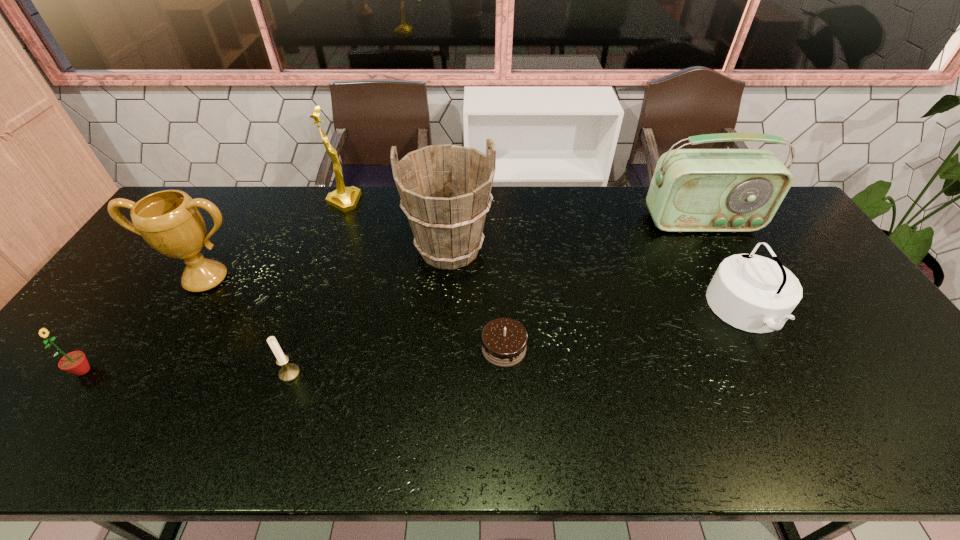
You are a GUI agent. You are given a task and a screenshot of the screen. Output one action in this format:
    pyautogui.click(x=<x>, y=<y>)
    Task: Click on the vacant space located 0.050m on the front of the bucket
    The image size is (960, 540).
    Given the screenshot: What is the action you would take?
    pyautogui.click(x=447, y=293)

Find the location of a particular element. vacant space situated 0.350m on the front-facing side of the farther award is located at coordinates (459, 202).

Locate an element on the screen. This screenshot has height=540, width=960. free space located on the front panel of the radio receiver is located at coordinates (746, 303).

This screenshot has height=540, width=960. I want to click on free region located on the front of the left award with the decoration, so coord(185,314).

Where is `free location located on the spout of the kettle`? This screenshot has width=960, height=540. free location located on the spout of the kettle is located at coordinates (638, 312).

Identify the location of vacant space situated 0.050m on the spout of the kettle. This screenshot has height=540, width=960. (693, 312).

Locate an element on the screen. free space located on the spout of the kettle is located at coordinates (591, 312).

Find the location of a particular element. The height and width of the screenshot is (540, 960). free space located on the face of the leftmost object is located at coordinates (143, 370).

This screenshot has width=960, height=540. In order to click on blank area located 0.290m on the back of the candle holder in this screenshot , I will do `click(322, 280)`.

At what (x,y) coordinates should I click in order to perform the action: click on vacant region located 0.060m on the back of the chocolate cake. Please return your answer as a coordinate pair (x, y). The height and width of the screenshot is (540, 960). Looking at the image, I should click on (502, 313).